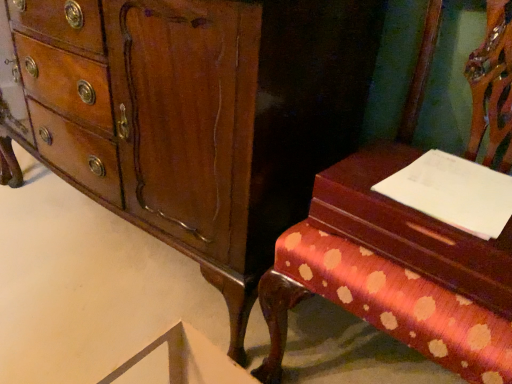
Identify the location of mahogany wood chest of drawers at center. This screenshot has width=512, height=384. (197, 115).

From a real-world perspective, which is physically above, polka dot fabric bench at right or wooden vanity at right?

wooden vanity at right is physically above.

Considering their positions, is polka dot fabric bench at right located in front of or behind wooden vanity at right?

polka dot fabric bench at right is in front of wooden vanity at right.

This screenshot has width=512, height=384. In the image, there is a wooden vanity at right. What are the coordinates of `furniture below it (from a real-world perspective)` in the screenshot? It's located at click(x=395, y=261).

Who is smaller, polka dot fabric bench at right or wooden vanity at right?

With smaller size is wooden vanity at right.

Is mahogany wood chest of drawers at center directly adjacent to white paper at right?

mahogany wood chest of drawers at center and white paper at right are not in contact.

Is the position of mahogany wood chest of drawers at center more distant than that of white paper at right?

That is False.

Visually, is mahogany wood chest of drawers at center positioned to the left or to the right of white paper at right?

From the image, it's evident that mahogany wood chest of drawers at center is to the left of white paper at right.

Is white paper at right located within mahogany wood chest of drawers at center?

Definitely not — white paper at right is not inside mahogany wood chest of drawers at center.

Considering the points (352, 233) and (407, 277), which point is behind, point (352, 233) or point (407, 277)?

The point (352, 233) is farther.

Looking at this image, from the image's perspective, relative to polka dot fabric bench at right, is wooden vanity at right above or below?

Based on their image positions, wooden vanity at right is located above polka dot fabric bench at right.

Which object is positioned more to the left, wooden vanity at right or polka dot fabric bench at right?

wooden vanity at right is more to the left.

Would you say mahogany wood chest of drawers at center is outside polka dot fabric bench at right?

Yes.

From a real-world perspective, who is located higher, mahogany wood chest of drawers at center or polka dot fabric bench at right?

In real-world perspective, polka dot fabric bench at right is above.

Locate an element on the screen. This screenshot has width=512, height=384. chest of drawers behind the polka dot fabric bench at right is located at coordinates (197, 115).

Does mahogany wood chest of drawers at center have a lesser width compared to polka dot fabric bench at right?

Indeed, mahogany wood chest of drawers at center has a lesser width compared to polka dot fabric bench at right.

From the image's perspective, is white paper at right over mahogany wood chest of drawers at center?

Incorrect, from the image's perspective, white paper at right is lower than mahogany wood chest of drawers at center.

From a real-world perspective, is white paper at right positioned under mahogany wood chest of drawers at center based on gravity?

Incorrect, from a real-world perspective, white paper at right is higher than mahogany wood chest of drawers at center.

Considering the positions of objects white paper at right and mahogany wood chest of drawers at center in the image provided, who is more to the left, white paper at right or mahogany wood chest of drawers at center?

mahogany wood chest of drawers at center.

Is mahogany wood chest of drawers at center located within white paper at right?

No, mahogany wood chest of drawers at center is located outside of white paper at right.

From their relative heights in the image, would you say polka dot fabric bench at right is taller or shorter than white paper at right?

Considering their sizes, polka dot fabric bench at right has more height than white paper at right.

Can you confirm if polka dot fabric bench at right is bigger than white paper at right?

Yes.

Is mahogany wood chest of drawers at center far from wooden vanity at right?

That's not correct — mahogany wood chest of drawers at center is a little close to wooden vanity at right.

Can you confirm if mahogany wood chest of drawers at center is bigger than wooden vanity at right?

Correct, mahogany wood chest of drawers at center is larger in size than wooden vanity at right.

Image resolution: width=512 pixels, height=384 pixels. Identify the location of vanity above the mahogany wood chest of drawers at center (from a real-world perspective). (410, 228).

Which of these two, mahogany wood chest of drawers at center or wooden vanity at right, stands taller?

With more height is mahogany wood chest of drawers at center.

Find the location of a particular element. The image size is (512, 384). vanity above the polka dot fabric bench at right (from the image's perspective) is located at coordinates (410, 228).

Find the location of a particular element. This screenshot has height=384, width=512. notepad above the mahogany wood chest of drawers at center (from a real-world perspective) is located at coordinates (453, 192).

Considering their positions, is polka dot fabric bench at right positioned further to wooden vanity at right than mahogany wood chest of drawers at center?

The object further to wooden vanity at right is mahogany wood chest of drawers at center.

Looking at the image, which one is located closer to polka dot fabric bench at right, wooden vanity at right or white paper at right?

wooden vanity at right.

Looking at the image, which one is located further to polka dot fabric bench at right, white paper at right or mahogany wood chest of drawers at center?

The object further to polka dot fabric bench at right is mahogany wood chest of drawers at center.

Considering their positions, is white paper at right positioned closer to mahogany wood chest of drawers at center than polka dot fabric bench at right?

Based on the image, polka dot fabric bench at right appears to be nearer to mahogany wood chest of drawers at center.

Which object lies further to the anchor point white paper at right, polka dot fabric bench at right or mahogany wood chest of drawers at center?

mahogany wood chest of drawers at center is positioned further to the anchor white paper at right.

From the image, which object appears to be farther from polka dot fabric bench at right, wooden vanity at right or mahogany wood chest of drawers at center?

mahogany wood chest of drawers at center.

Which object lies further to the anchor point polka dot fabric bench at right, mahogany wood chest of drawers at center or wooden vanity at right?

Among the two, mahogany wood chest of drawers at center is located further to polka dot fabric bench at right.

When comparing their distances from wooden vanity at right, does polka dot fabric bench at right or white paper at right seem further?

Among the two, polka dot fabric bench at right is located further to wooden vanity at right.

The image size is (512, 384). I want to click on vanity situated between mahogany wood chest of drawers at center and white paper at right from left to right, so click(410, 228).

At what (x,y) coordinates should I click in order to perform the action: click on furniture between mahogany wood chest of drawers at center and white paper at right in the horizontal direction. Please return your answer as a coordinate pair (x, y). The width and height of the screenshot is (512, 384). Looking at the image, I should click on (395, 261).

At what (x,y) coordinates should I click in order to perform the action: click on vanity located between polka dot fabric bench at right and white paper at right in the depth direction. Please return your answer as a coordinate pair (x, y). Looking at the image, I should click on (410, 228).

Where is `vanity between mahogany wood chest of drawers at center and polka dot fabric bench at right from left to right`? vanity between mahogany wood chest of drawers at center and polka dot fabric bench at right from left to right is located at coordinates (410, 228).